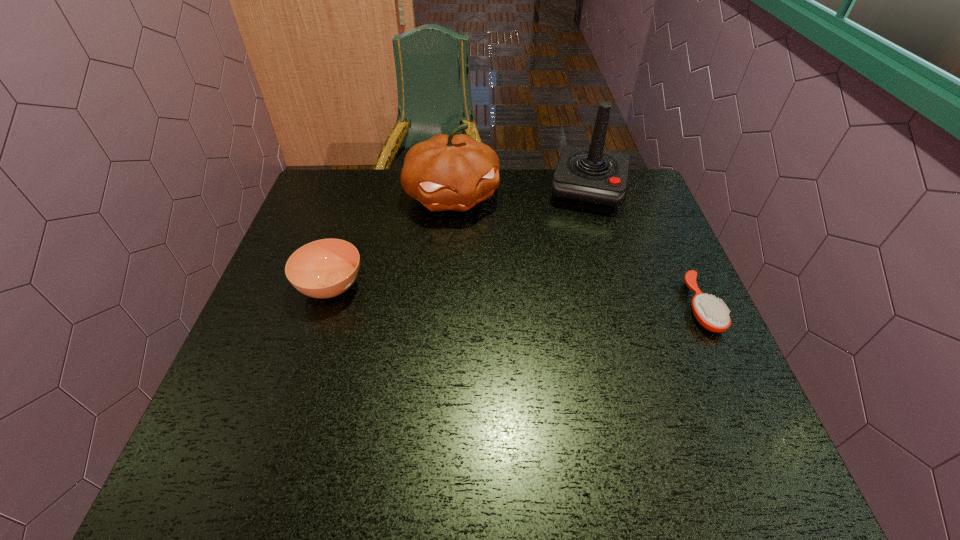
Find the location of a particular element. The image size is (960, 540). unoccupied area between the shortest object and the pumpkin is located at coordinates (577, 251).

Where is `vacant space in between the rightmost object and the tallest object`? The image size is (960, 540). vacant space in between the rightmost object and the tallest object is located at coordinates (644, 249).

Where is `free space between the soup bowl and the second tallest object`? The height and width of the screenshot is (540, 960). free space between the soup bowl and the second tallest object is located at coordinates (392, 241).

Locate an element on the screen. This screenshot has width=960, height=540. vacant area that lies between the second shortest object and the hairbrush is located at coordinates (516, 296).

Where is `free space between the second object from left to right and the third object from left to right`? The image size is (960, 540). free space between the second object from left to right and the third object from left to right is located at coordinates (520, 193).

Identify the location of vacant area that lies between the second shortest object and the pumpkin. Image resolution: width=960 pixels, height=540 pixels. (392, 241).

The image size is (960, 540). What are the coordinates of `vacant area that lies between the second shortest object and the joystick` in the screenshot? It's located at (460, 239).

Where is `vacant area that lies between the rightmost object and the second object from right to left`? This screenshot has width=960, height=540. vacant area that lies between the rightmost object and the second object from right to left is located at coordinates (644, 249).

Locate which object is the second closest to the hairbrush. Please provide its 2D coordinates. Your answer should be formatted as a tuple, i.e. [(x, y)], where the tuple contains the x and y coordinates of a point satisfying the conditions above.

[(454, 172)]

The height and width of the screenshot is (540, 960). In order to click on the closest object to the joystick in this screenshot , I will do `click(454, 172)`.